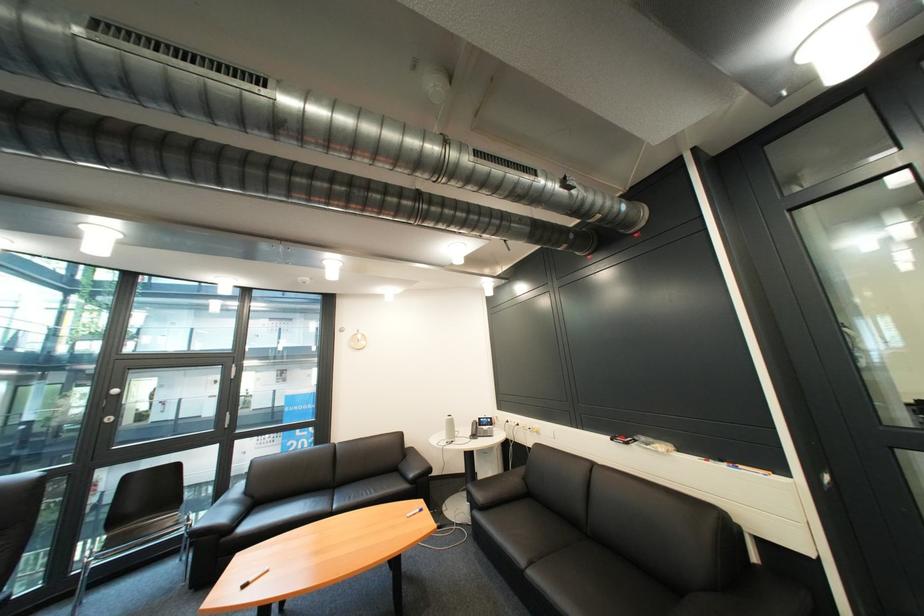
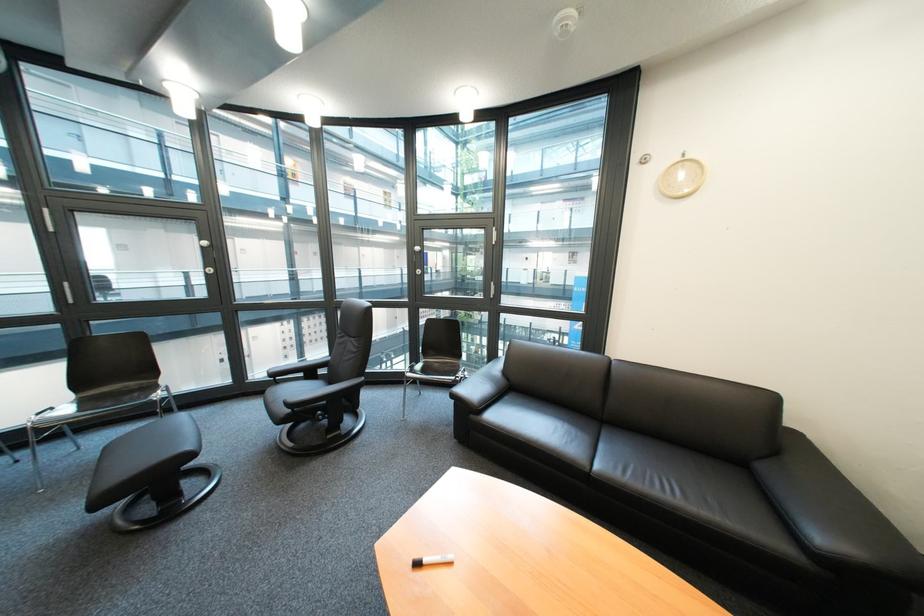
The point at [237,541] is marked in the first image. Where is the corresponding point in the second image?

(485, 418)